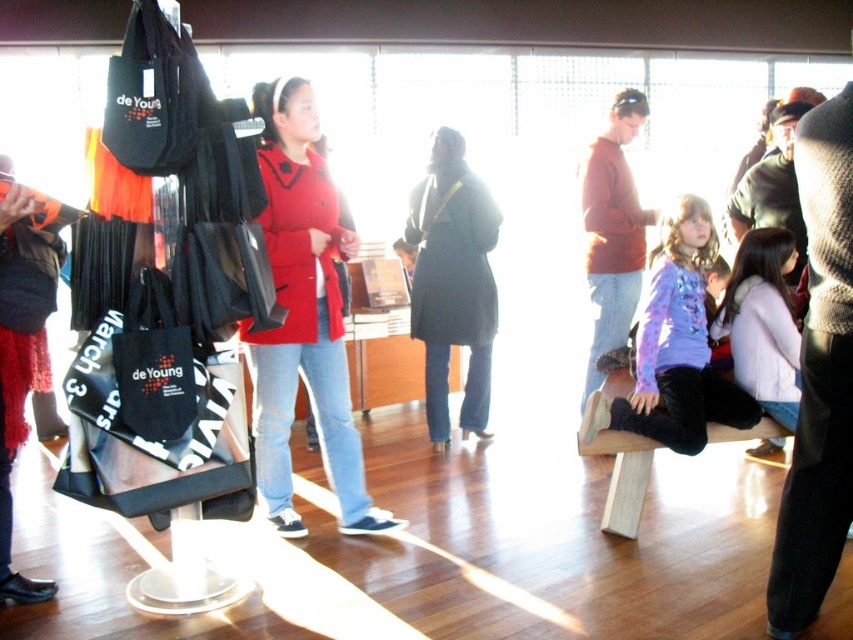
Question: Does dark gray coat at center appear on the left side of purple sweater at center?

Choices:
 (A) no
 (B) yes

Answer: (B)

Question: Which point is closer to the camera?

Choices:
 (A) (303, 284)
 (B) (587, 284)
 (C) (154, 276)

Answer: (C)

Question: Which point appears farthest from the camera in this image?

Choices:
 (A) (764, 413)
 (B) (268, 356)
 (C) (136, 298)
 (D) (596, 260)

Answer: (D)

Question: Can you confirm if matte red coat at center is positioned below matte red sweater at center?

Choices:
 (A) no
 (B) yes

Answer: (B)

Question: Which object appears closest to the camera in this image?

Choices:
 (A) matte red coat at center
 (B) dark gray coat at center
 (C) black canvas tote at center

Answer: (C)

Question: In this image, where is matte red coat at center located relative to dark gray coat at center?

Choices:
 (A) above
 (B) below

Answer: (B)